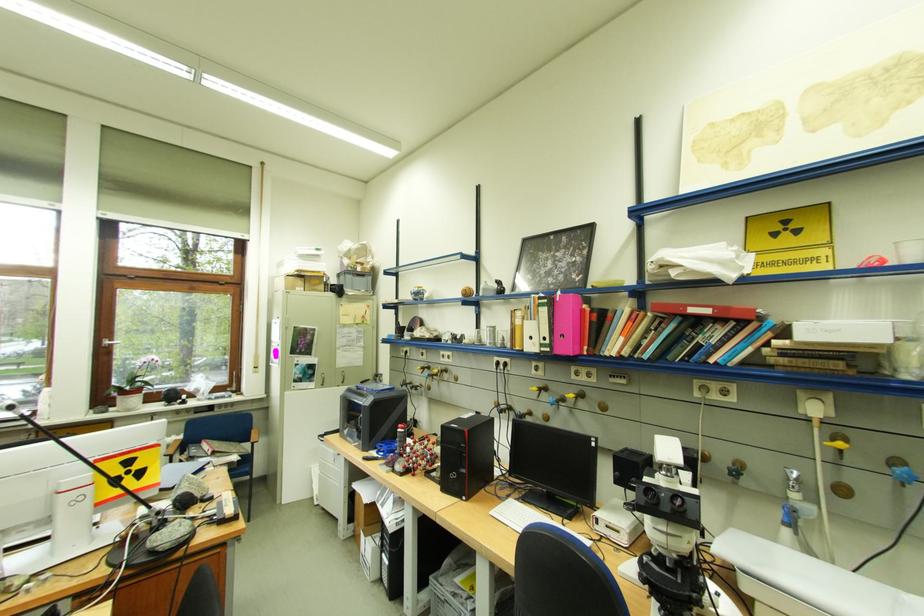
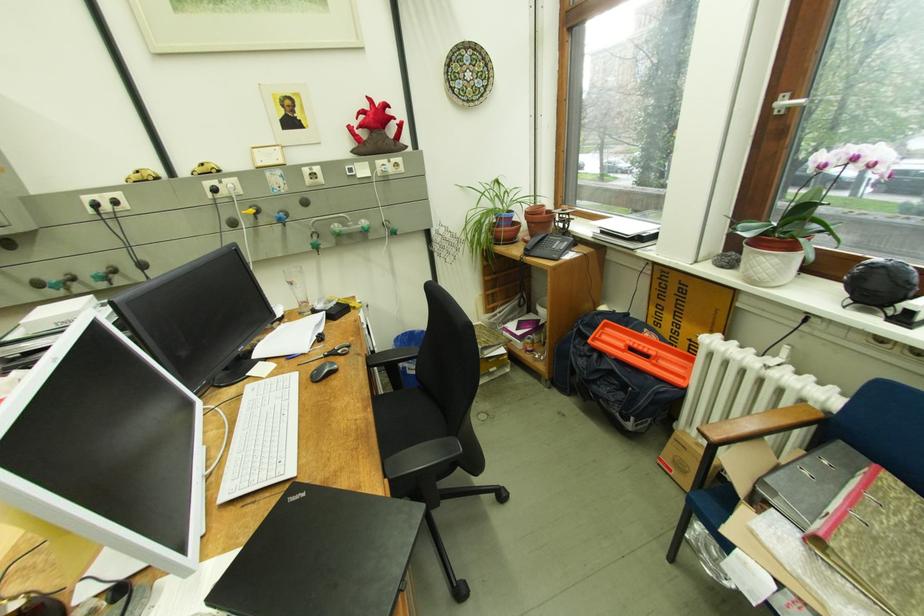
Locate, in the second image, the point that corresponds to (x=117, y=342) in the first image.

(794, 103)